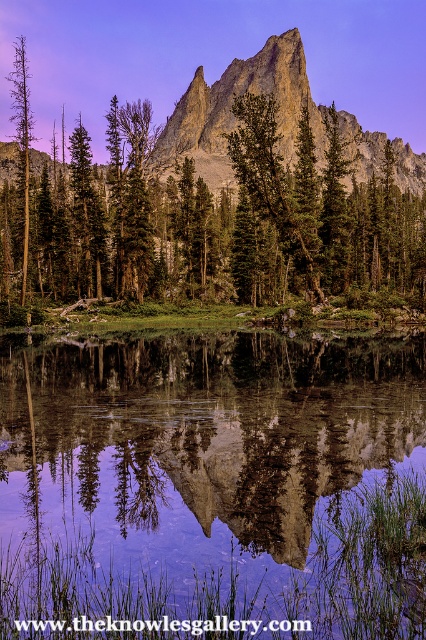
Consider the image. You are planning to take a photo of the landscape. You want to capture both the green matte tree at center and the rugged granite peak at center in the same frame. Which object should you zoom in on to ensure both are visible without moving the camera?

Since the green matte tree at center is narrower than the rugged granite peak at center, you should zoom in on the rugged granite peak at center to ensure both fit within the frame.

Consider the image. You are a hiker standing at the edge of the forest looking at the green matte tree at center and the green matte tree at left. Which tree would you need to look up to more to see the top of?

The green matte tree at left is taller than the green matte tree at center, so you would need to look up more to see the top of the green matte tree at left.